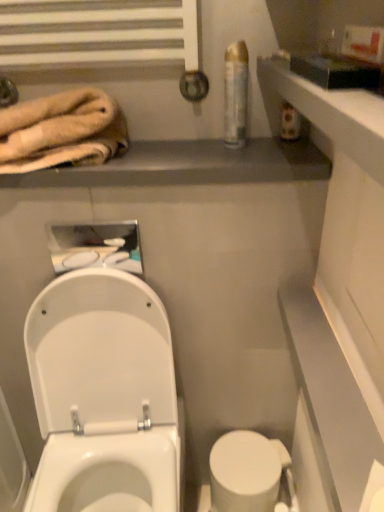
Question: Does white glossy toilet at lower left have a lesser height compared to beige plush towel at upper left?

Choices:
 (A) yes
 (B) no

Answer: (B)

Question: Can you confirm if white glossy toilet at lower left is positioned to the right of beige plush towel at upper left?

Choices:
 (A) no
 (B) yes

Answer: (B)

Question: From a real-world perspective, is white glossy toilet at lower left positioned over beige plush towel at upper left based on gravity?

Choices:
 (A) no
 (B) yes

Answer: (A)

Question: From a real-world perspective, is white glossy toilet at lower left positioned under beige plush towel at upper left based on gravity?

Choices:
 (A) no
 (B) yes

Answer: (B)

Question: From the image's perspective, is white glossy toilet at lower left on top of beige plush towel at upper left?

Choices:
 (A) yes
 (B) no

Answer: (B)

Question: Considering the relative positions of white glossy toilet at lower left and beige plush towel at upper left in the image provided, is white glossy toilet at lower left to the left of beige plush towel at upper left from the viewer's perspective?

Choices:
 (A) no
 (B) yes

Answer: (A)

Question: From a real-world perspective, is white glossy toilet at lower left below metallic gray balustrade at upper center?

Choices:
 (A) yes
 (B) no

Answer: (A)

Question: Considering the relative sizes of white glossy toilet at lower left and metallic gray balustrade at upper center in the image provided, is white glossy toilet at lower left taller than metallic gray balustrade at upper center?

Choices:
 (A) yes
 (B) no

Answer: (A)

Question: Can you confirm if white glossy toilet at lower left is smaller than metallic gray balustrade at upper center?

Choices:
 (A) yes
 (B) no

Answer: (B)

Question: Is white glossy toilet at lower left at the left side of metallic gray balustrade at upper center?

Choices:
 (A) no
 (B) yes

Answer: (B)

Question: Is white glossy toilet at lower left closer to camera compared to metallic gray balustrade at upper center?

Choices:
 (A) yes
 (B) no

Answer: (A)

Question: Is white glossy toilet at lower left wider than metallic gray balustrade at upper center?

Choices:
 (A) no
 (B) yes

Answer: (B)

Question: From a real-world perspective, is white glossy toilet at lower left under clear plastic can at upper right?

Choices:
 (A) no
 (B) yes

Answer: (B)